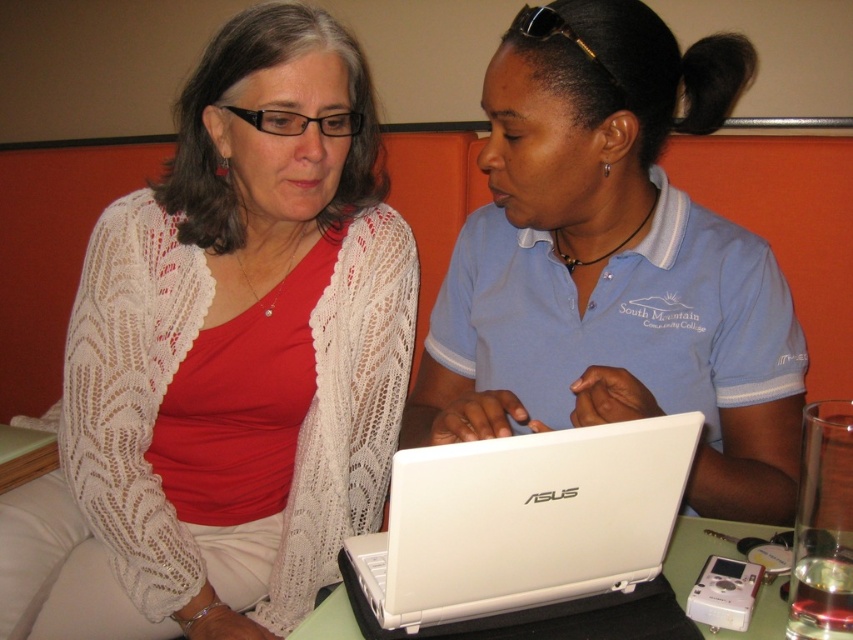
You are a photographer setting up a shoot at the table. You want to place a small prop between the matte white sweater at center and the white plastic laptop at center. Based on their positions, which object should the prop be closer to if you want it aligned with the laptop?

The matte white sweater at center is to the left of the white plastic laptop at center. To align the prop with the laptop, place it closer to the white plastic laptop at center.

You are a photographer taking a picture of the scene. You want to focus on the white lace cardigan at center without the white matte laptop at center blocking it. Is this possible given their positions?

The white matte laptop at center is closer to the viewer than the white lace cardigan at center, so the laptop is blocking the cardigan. You cannot focus on the white lace cardigan at center without moving the laptop.

You are standing in front of the table where two people are working on an ASUS laptop. There is a point at coordinate (589, 250). If you want to place a 2.5 feet wide object between you and that point, will it fit without overlapping?

The distance between you and the point is 3.50 feet. Since the object is 2.5 feet wide, there is enough space to place it without overlapping.